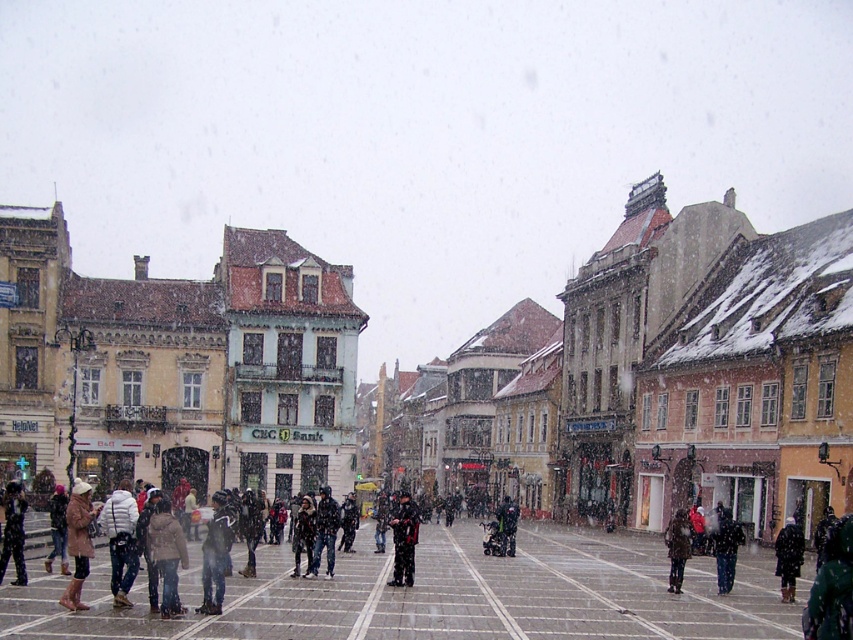
Is point (78, 480) positioned before point (677, 580)?

That is False.

Measure the distance from tan suede coat at lower left to dark brown leather coat at center.

The distance of tan suede coat at lower left from dark brown leather coat at center is 43.56 meters.

Between point (68, 499) and point (682, 572), which one is positioned behind?

The point (682, 572) is behind.

What are the coordinates of `tan suede coat at lower left` in the screenshot? It's located at (78, 541).

Between point (225, 532) and point (735, 561), which one is positioned behind?

Positioned behind is point (735, 561).

Does dark gray jacket at center come behind dark gray fabric jacket at center?

That is False.

Is point (221, 595) positioned behind point (717, 556)?

That is False.

Identify the location of dark gray jacket at center. The height and width of the screenshot is (640, 853). (216, 554).

Who is positioned more to the right, yellow matte building at center or tan suede coat at lower left?

From the viewer's perspective, yellow matte building at center appears more on the right side.

Which is in front, point (688, 262) or point (85, 490)?

Point (85, 490)

Measure the distance between point (461, 483) and camera.

169.34 meters

Find the location of a particular element. The width and height of the screenshot is (853, 640). yellow matte building at center is located at coordinates (453, 372).